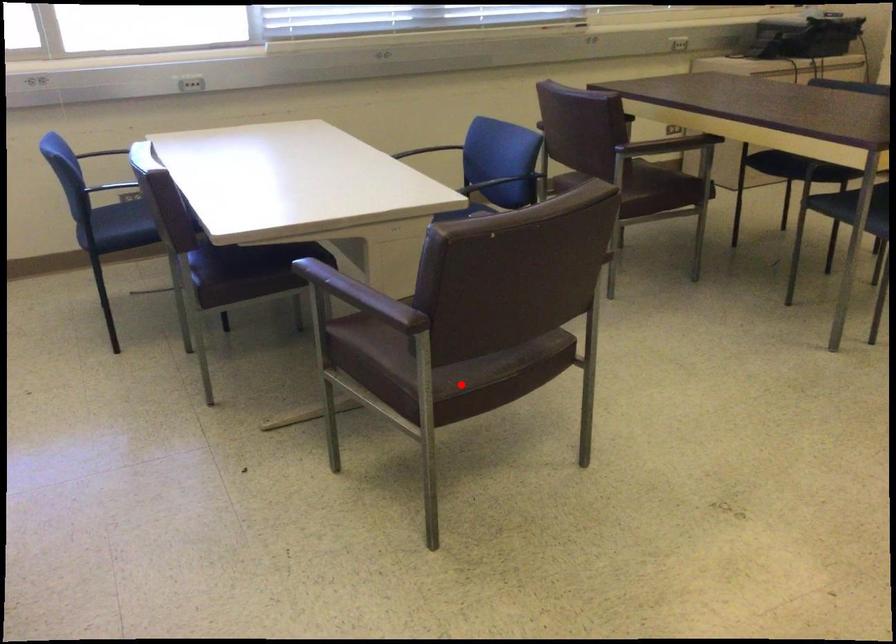
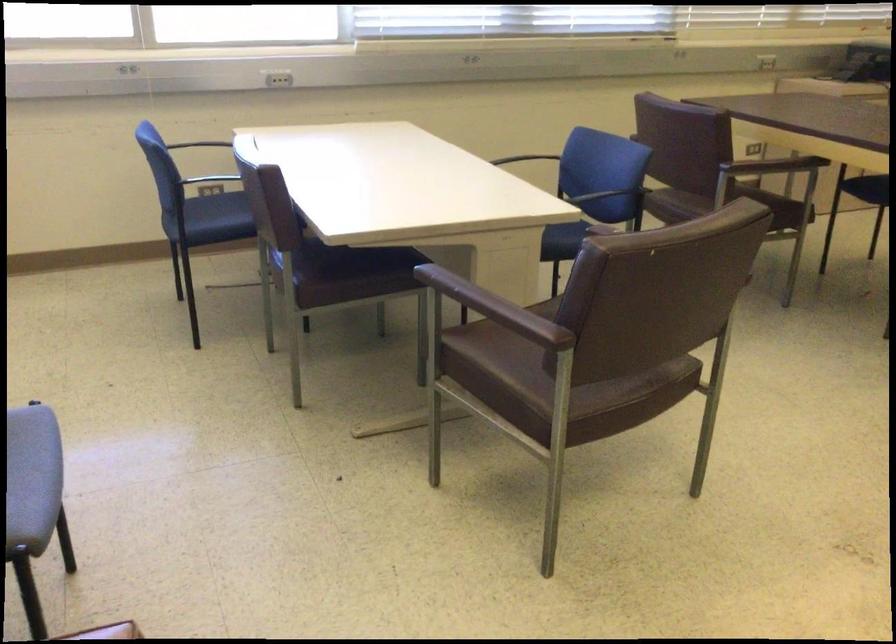
The point at the highlighted location is marked in the first image. Where is the corresponding point in the second image?

(588, 404)